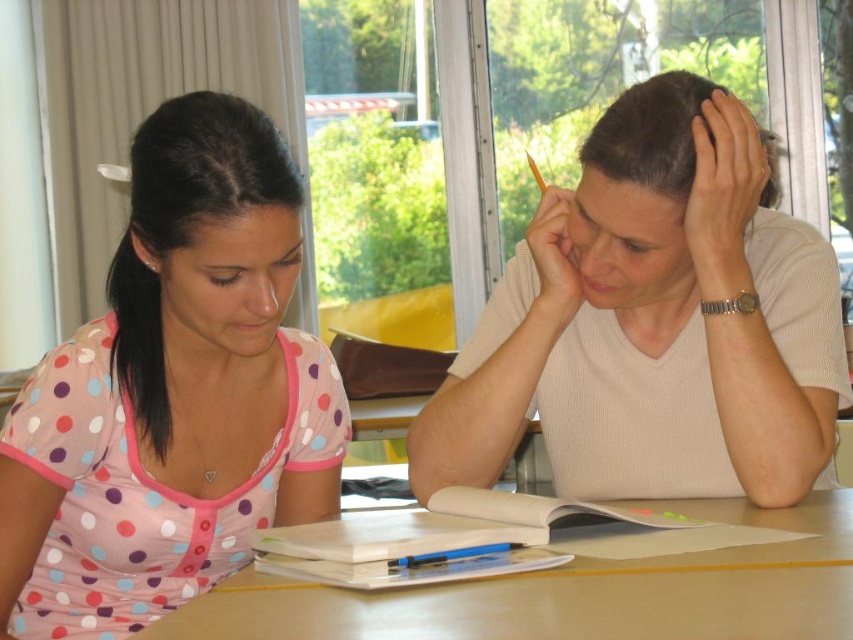
You are a photographer standing in front of the scene. You want to take a photo of the white matte shirt at upper right and the wooden table at center. Which object should you focus on first if you want to capture both in sharp focus?

The white matte shirt at upper right has a greater height compared to wooden table at center, so you should focus on the white matte shirt at upper right first to ensure both are in sharp focus.

You are a student sitting at a table with two points marked on it. You need to determine which point is closer to you. The points are labeled as point (175, 298) and point (592, 157). Which point is closer to your current position?

Point (175, 298) is closer to you because it is in front of point (592, 157).